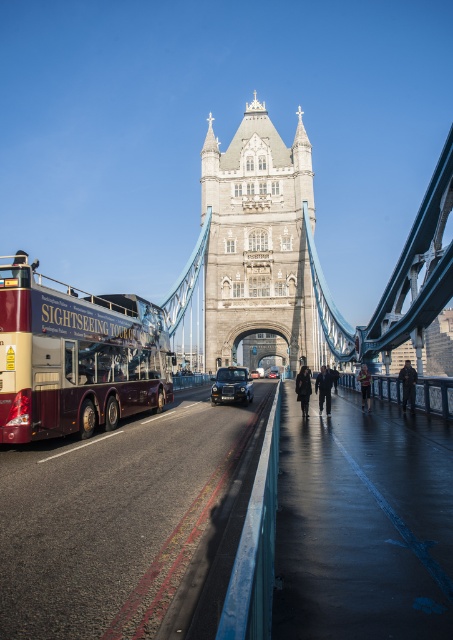
Question: Which of the following is the closest to the observer?

Choices:
 (A) shiny black car at center
 (B) maroon metallic tour bus at left
 (C) dark blue jeans at center
 (D) dark brown leather coat at center

Answer: (B)

Question: Observing the image, what is the correct spatial positioning of maroon metallic tour bus at left in reference to dark blue jacket at right?

Choices:
 (A) right
 (B) left

Answer: (B)

Question: Is black metallic car at center in front of dark brown leather coat at center?

Choices:
 (A) no
 (B) yes

Answer: (A)

Question: Where is dark suit at center located in relation to dark brown leather coat at center in the image?

Choices:
 (A) right
 (B) left

Answer: (A)

Question: Which of the following is the closest to the observer?

Choices:
 (A) (47, 401)
 (B) (239, 396)

Answer: (A)

Question: Considering the real-world distances, which object is farthest from the dark blue jeans at center?

Choices:
 (A) shiny black car at center
 (B) stone gothic tower at center

Answer: (B)